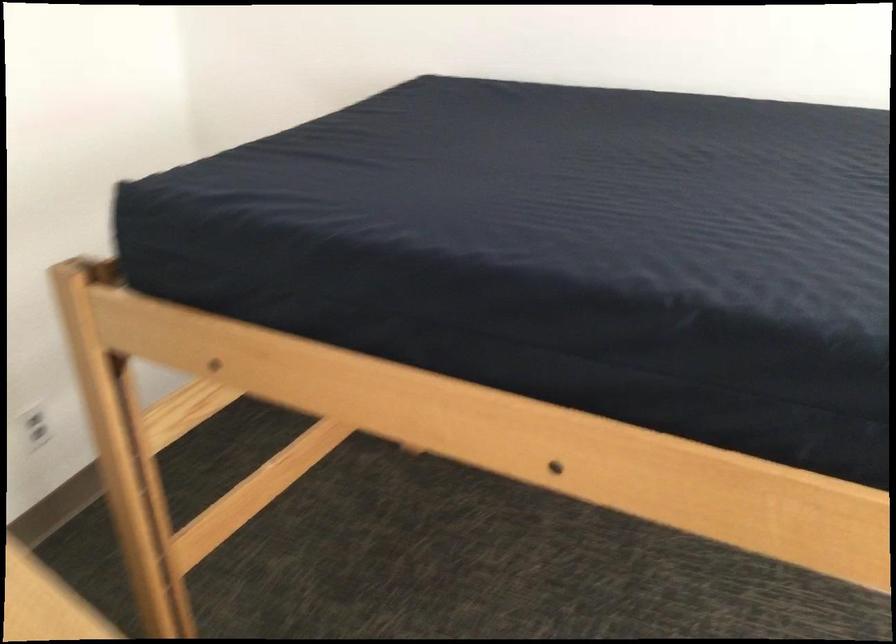
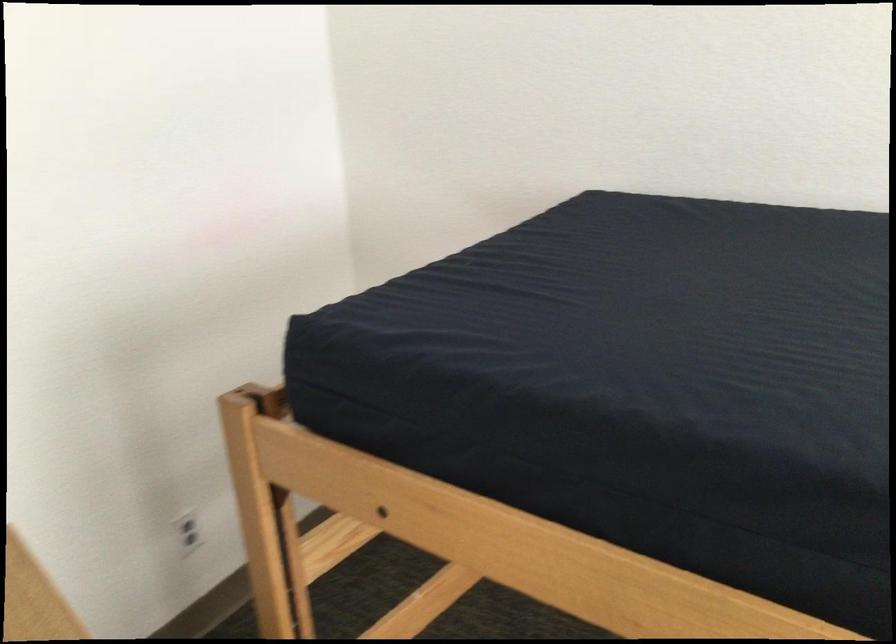
Question: How did the camera likely rotate?

Choices:
 (A) Left
 (B) Right
 (C) Up
 (D) Down

Answer: (A)